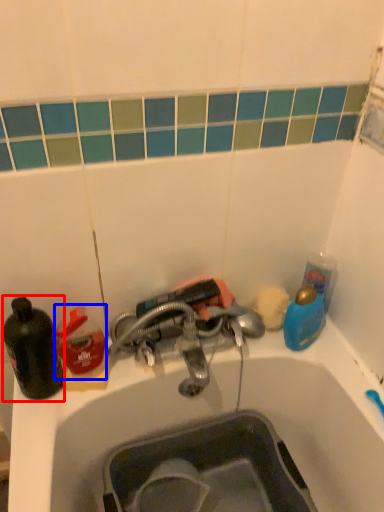
Question: Which point is closer to the camera, bottle (highlighted by a red box) or cleaning product (highlighted by a blue box)?

Choices:
 (A) bottle
 (B) cleaning product

Answer: (A)